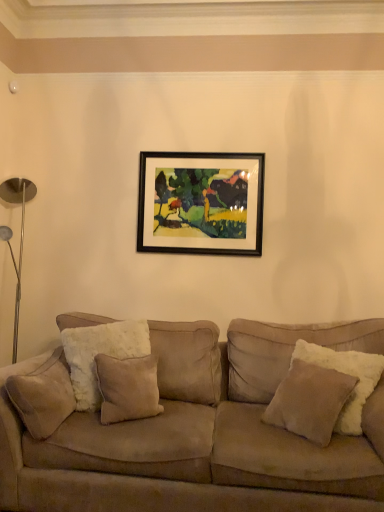
Question: Is suede couch at center outside of suede/velvet pillow at left, the second pillow when ordered from right to left?

Choices:
 (A) no
 (B) yes

Answer: (B)

Question: Is suede couch at center not close to suede/velvet pillow at left, the second pillow when ordered from right to left?

Choices:
 (A) yes
 (B) no

Answer: (B)

Question: Is suede couch at center at the left side of suede/velvet pillow at left, placed as the first pillow when sorted from left to right?

Choices:
 (A) yes
 (B) no

Answer: (B)

Question: Considering the relative sizes of suede couch at center and suede/velvet pillow at left, the second pillow when ordered from right to left, in the image provided, is suede couch at center wider than suede/velvet pillow at left, the second pillow when ordered from right to left,?

Choices:
 (A) yes
 (B) no

Answer: (A)

Question: Is suede couch at center with suede/velvet pillow at left, the second pillow when ordered from right to left?

Choices:
 (A) yes
 (B) no

Answer: (B)

Question: Is the depth of suede couch at center less than that of suede/velvet pillow at left, the second pillow when ordered from right to left?

Choices:
 (A) yes
 (B) no

Answer: (A)

Question: Is black framed painting at upper center at the right side of beige suede pillow at right, the 2th pillow viewed from the left?

Choices:
 (A) no
 (B) yes

Answer: (A)

Question: Considering the relative sizes of black framed painting at upper center and beige suede pillow at right, the 1th pillow when ordered from right to left, in the image provided, is black framed painting at upper center shorter than beige suede pillow at right, the 1th pillow when ordered from right to left,?

Choices:
 (A) yes
 (B) no

Answer: (B)

Question: Is black framed painting at upper center oriented away from beige suede pillow at right, the 2th pillow viewed from the left?

Choices:
 (A) no
 (B) yes

Answer: (A)

Question: Does black framed painting at upper center touch beige suede pillow at right, the 2th pillow viewed from the left?

Choices:
 (A) no
 (B) yes

Answer: (A)

Question: Would you say black framed painting at upper center contains beige suede pillow at right, the 1th pillow when ordered from right to left?

Choices:
 (A) yes
 (B) no

Answer: (B)

Question: Is black framed painting at upper center positioned beyond the bounds of beige suede pillow at right, the 1th pillow when ordered from right to left?

Choices:
 (A) yes
 (B) no

Answer: (A)

Question: Is black framed painting at upper center not within suede couch at center?

Choices:
 (A) yes
 (B) no

Answer: (A)